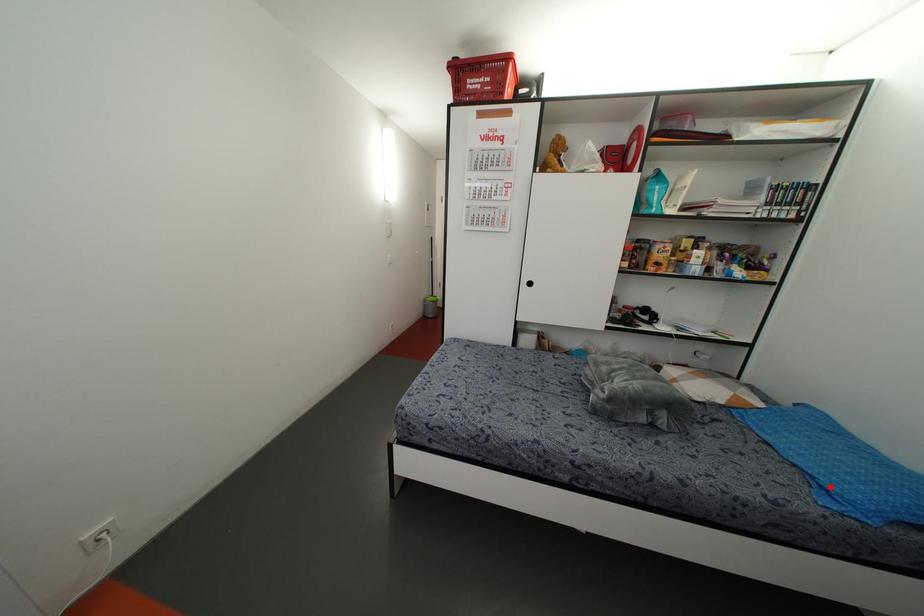
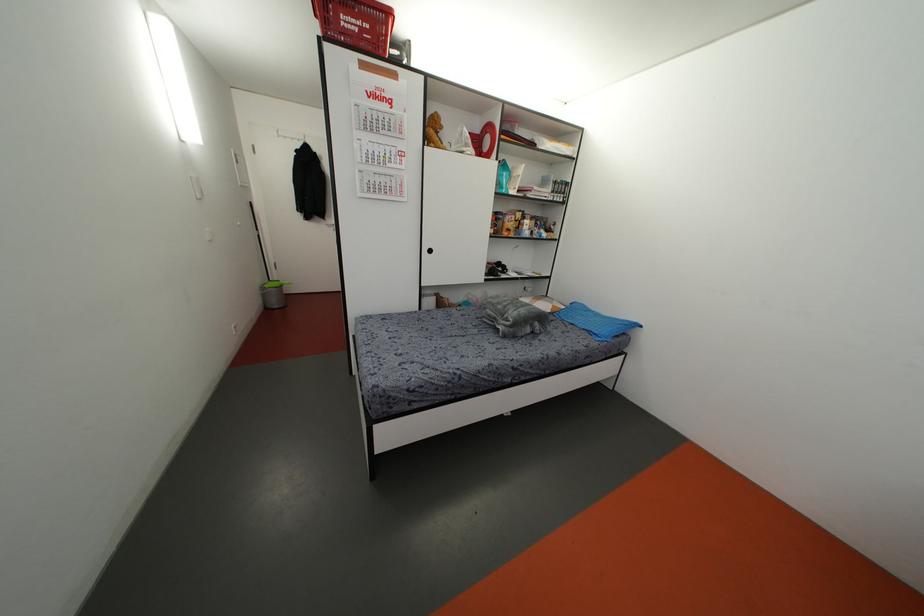
Question: I am providing you with two images of the same scene from different viewpoints. In image1, a red point is highlighted. Considering the same 3D point in image2, which of the following is correct?

Choices:
 (A) It is closer
 (B) It is farther

Answer: (B)